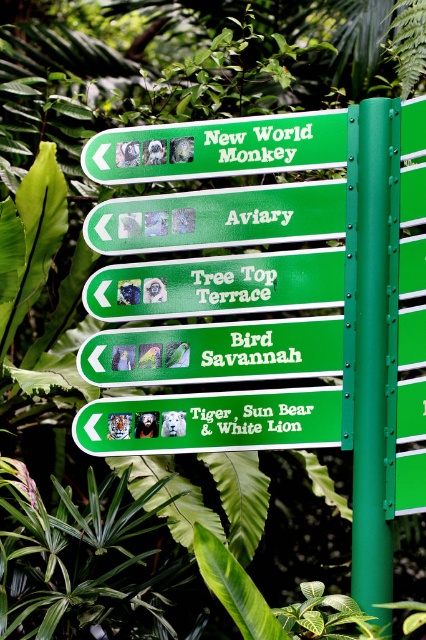
You are a painter who needs to decide whether to bring a small or large brush to paint the green painted metal pole at center right and the green matte sign at center. Based on their sizes, which brush should you choose for each object?

The green painted metal pole at center right is narrower than the green matte sign at center, so you should use a small brush for the pole and a large brush for the sign.

You are standing in front of the green painted metal pole at center right and the green plastic sign at upper center. Which object is taller?

The green painted metal pole at center right is taller than the green plastic sign at upper center.

You are a maintenance worker holding a 1.0 meter long ladder. You need to reach both the green painted metal pole at center right and the green matte sign at center to check their stability. Can you place the ladder between them to safely reach both objects?

The green painted metal pole at center right and green matte sign at center are 1.10 meters apart. Since the ladder is 1.0 meters long, it is shorter than the distance between them. Therefore, the ladder cannot span the gap between the two objects, making it unsafe to reach both simultaneously.